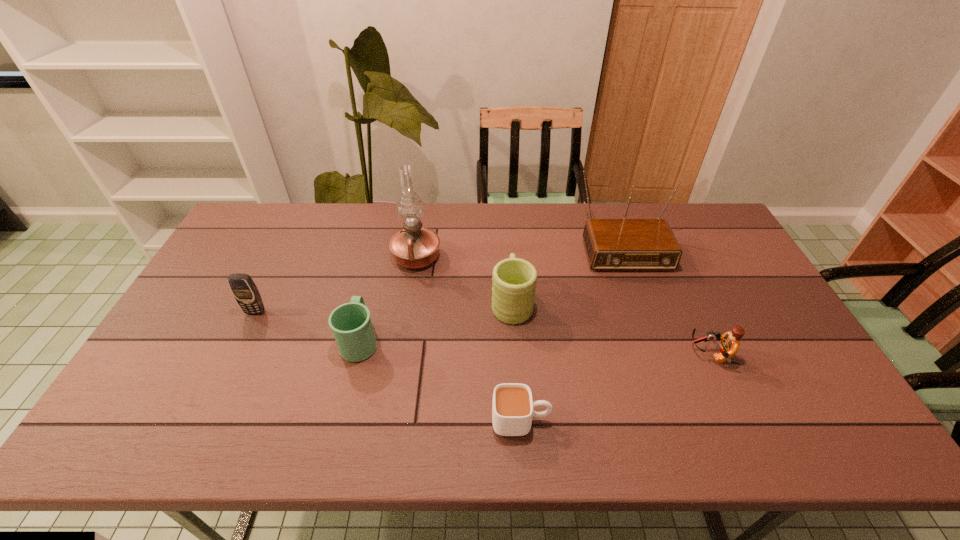
Identify the location of empty location between the taller mug and the Lego. This screenshot has height=540, width=960. click(x=611, y=328).

Locate an element on the screen. The height and width of the screenshot is (540, 960). empty space that is in between the Lego and the cup is located at coordinates (615, 387).

This screenshot has height=540, width=960. Find the location of `free space between the second tallest object and the oil lamp`. free space between the second tallest object and the oil lamp is located at coordinates (517, 248).

Where is `free space between the right mug and the leftmost object`? Image resolution: width=960 pixels, height=540 pixels. free space between the right mug and the leftmost object is located at coordinates (384, 307).

Where is `empty location between the right mug and the nearest object`? The height and width of the screenshot is (540, 960). empty location between the right mug and the nearest object is located at coordinates (516, 361).

At what (x,y) coordinates should I click in order to perform the action: click on free space that is in between the radio_receiver and the cellular telephone. Please return your answer as a coordinate pair (x, y). Looking at the image, I should click on (437, 276).

Identify the location of unoccupied area between the sixth shortest object and the taller mug. (565, 271).

Locate an element on the screen. The width and height of the screenshot is (960, 540). vacant region between the left mug and the radio_receiver is located at coordinates point(490,290).

Locate an element on the screen. This screenshot has width=960, height=540. unoccupied area between the Lego and the shorter mug is located at coordinates (535, 348).

Locate an element on the screen. the sixth closest object to the leftmost object is located at coordinates (729, 345).